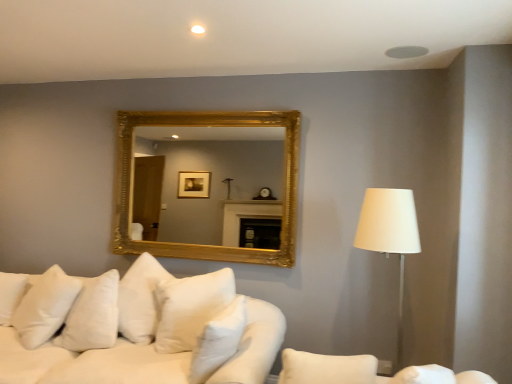
Question: Is white soft pillow at center, which ranks as the 2th pillow in left-to-right order, surrounded by gold/gilded mirror at upper center?

Choices:
 (A) no
 (B) yes

Answer: (A)

Question: Considering the relative positions of gold/gilded mirror at upper center and white soft pillow at center, placed as the 1th pillow when sorted from front to back, in the image provided, is gold/gilded mirror at upper center behind white soft pillow at center, placed as the 1th pillow when sorted from front to back,?

Choices:
 (A) no
 (B) yes

Answer: (B)

Question: Does gold/gilded mirror at upper center have a smaller size compared to white soft pillow at center, the second pillow from the back?

Choices:
 (A) yes
 (B) no

Answer: (B)

Question: Is gold/gilded mirror at upper center not close to white soft pillow at center, placed as the 1th pillow when sorted from front to back?

Choices:
 (A) yes
 (B) no

Answer: (A)

Question: Does gold/gilded mirror at upper center lie in front of white soft pillow at center, the second pillow from the back?

Choices:
 (A) no
 (B) yes

Answer: (A)

Question: Considering the positions of white soft cushions at lower left and white soft pillow at center, the second pillow from the back, in the image, is white soft cushions at lower left wider or thinner than white soft pillow at center, the second pillow from the back,?

Choices:
 (A) thin
 (B) wide

Answer: (B)

Question: From the image's perspective, relative to white soft pillow at center, the second pillow from the back, is white soft cushions at lower left above or below?

Choices:
 (A) below
 (B) above

Answer: (A)

Question: Is point (220, 271) closer or farther from the camera than point (203, 380)?

Choices:
 (A) farther
 (B) closer

Answer: (A)

Question: Is white soft cushions at lower left taller or shorter than white soft pillow at center, the 1th pillow from the right?

Choices:
 (A) short
 (B) tall

Answer: (B)

Question: Do you think white soft cushions at lower left is within white fabric couch at lower right, or outside of it?

Choices:
 (A) outside
 (B) inside

Answer: (A)

Question: From the image's perspective, relative to white fabric couch at lower right, is white soft cushions at lower left above or below?

Choices:
 (A) below
 (B) above

Answer: (A)

Question: Is white soft cushions at lower left to the left or to the right of white fabric couch at lower right in the image?

Choices:
 (A) right
 (B) left

Answer: (B)

Question: Does point coord(163,312) appear closer or farther from the camera than point coord(330,362)?

Choices:
 (A) farther
 (B) closer

Answer: (B)

Question: Considering the positions of white fabric lampshade at right and white soft cushions at lower left in the image, is white fabric lampshade at right bigger or smaller than white soft cushions at lower left?

Choices:
 (A) small
 (B) big

Answer: (A)

Question: Is white fabric lampshade at right in front of or behind white soft cushions at lower left in the image?

Choices:
 (A) front
 (B) behind

Answer: (B)